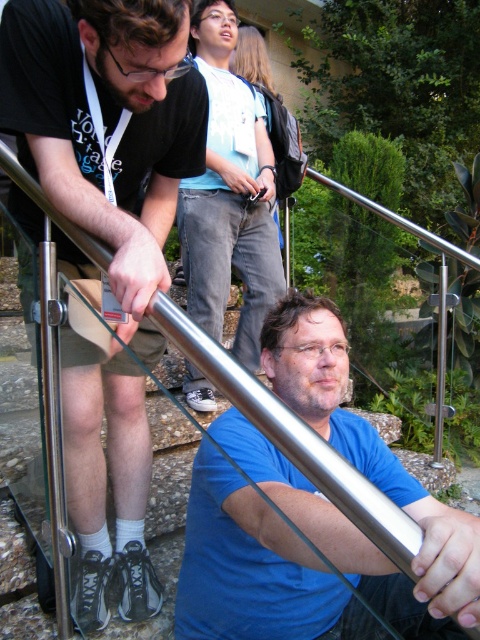
Question: Can you confirm if matte black shirt at center is positioned to the left of matte blue shirt at center?

Choices:
 (A) yes
 (B) no

Answer: (A)

Question: Which of the following is the closest to the observer?

Choices:
 (A) matte black shirt at center
 (B) matte blue shirt at center

Answer: (B)

Question: Which of the following is the farthest from the observer?

Choices:
 (A) matte black shirt at center
 (B) matte blue shirt at center

Answer: (A)

Question: Can you confirm if matte black shirt at center is thinner than matte blue shirt at center?

Choices:
 (A) no
 (B) yes

Answer: (B)

Question: Does matte black shirt at center appear on the right side of matte blue shirt at center?

Choices:
 (A) no
 (B) yes

Answer: (A)